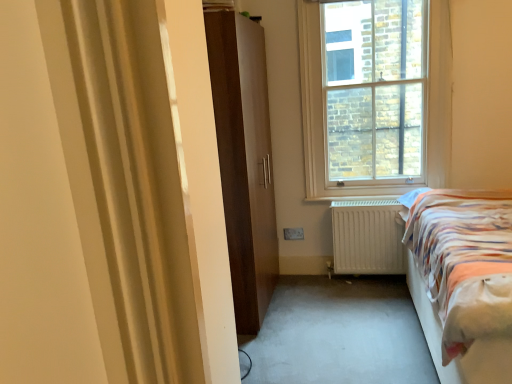
Question: In terms of width, does clear glass window at upper center look wider or thinner when compared to white matte radiator at lower center?

Choices:
 (A) thin
 (B) wide

Answer: (A)

Question: Does point (315, 135) appear closer or farther from the camera than point (385, 243)?

Choices:
 (A) closer
 (B) farther

Answer: (B)

Question: Which object is the closest to the white matte radiator at lower center?

Choices:
 (A) clear glass window at upper center
 (B) striped fabric bed at right
 (C) matte brown wardrobe at center

Answer: (A)

Question: Which of these objects is positioned farthest from the matte brown wardrobe at center?

Choices:
 (A) striped fabric bed at right
 (B) clear glass window at upper center
 (C) white matte radiator at lower center

Answer: (A)